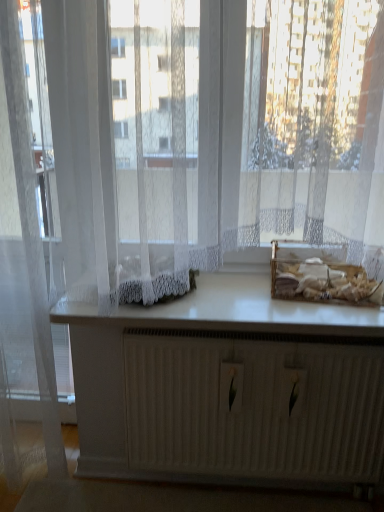
You are a GUI agent. You are given a task and a screenshot of the screen. Output one action in this format:
    pyautogui.click(x=<x>, y=<y>)
    Task: Click on the free region under white lace curtains at center (from a real-world perspective)
    
    Given the screenshot: What is the action you would take?
    pyautogui.click(x=260, y=312)